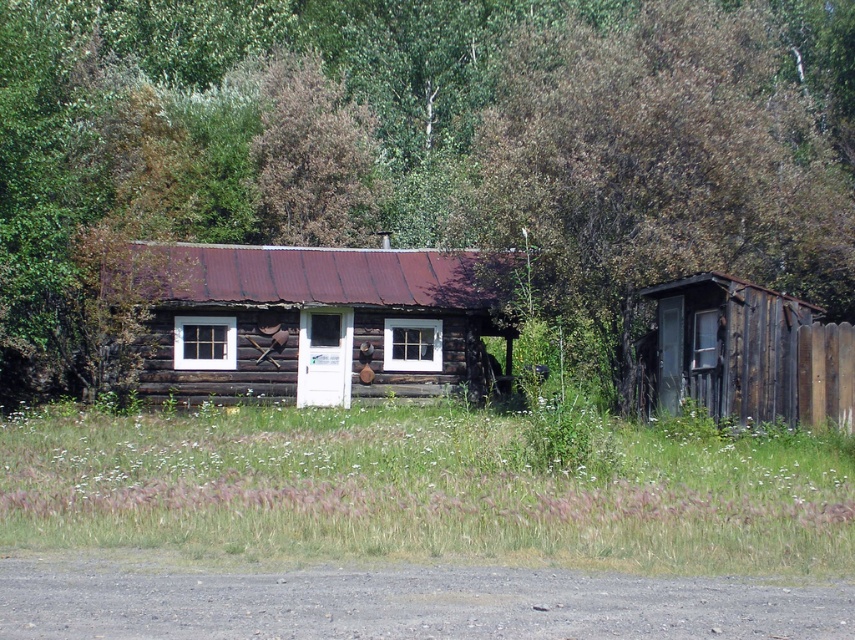
Between point (792, 90) and point (145, 346), which one is positioned in front?

Point (145, 346) is in front.

Which of these two, brown wood log cabin at center or weathered wood cabin at center, stands taller?

With more height is brown wood log cabin at center.

Where is `brown wood log cabin at center`? This screenshot has width=855, height=640. brown wood log cabin at center is located at coordinates (420, 148).

Measure the distance between brown wood log cabin at center and camera.

They are 75.58 feet apart.

Is brown wood log cabin at center thinner than brown wood tree at upper center?

In fact, brown wood log cabin at center might be wider than brown wood tree at upper center.

Measure the distance between brown wood log cabin at center and camera.

brown wood log cabin at center and camera are 75.58 feet apart.

Find the location of `brown wood log cabin at center`. brown wood log cabin at center is located at coordinates (420, 148).

Is point (490, 4) positioned after point (720, 44)?

Yes.

Is brown wood log cabin at center wider than brown wood fence at right?

Yes.

This screenshot has height=640, width=855. What are the coordinates of `brown wood log cabin at center` in the screenshot? It's located at (420, 148).